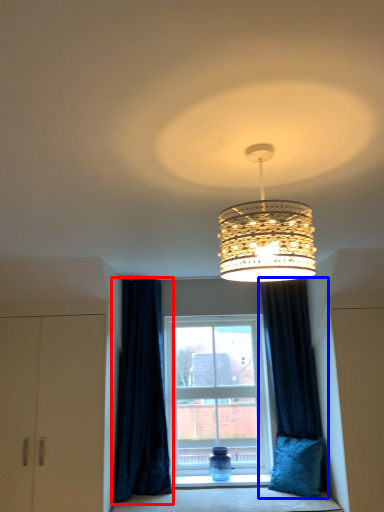
Question: Which object appears closest to the camera in this image, curtain (highlighted by a red box) or curtain (highlighted by a blue box)?

Choices:
 (A) curtain
 (B) curtain

Answer: (A)